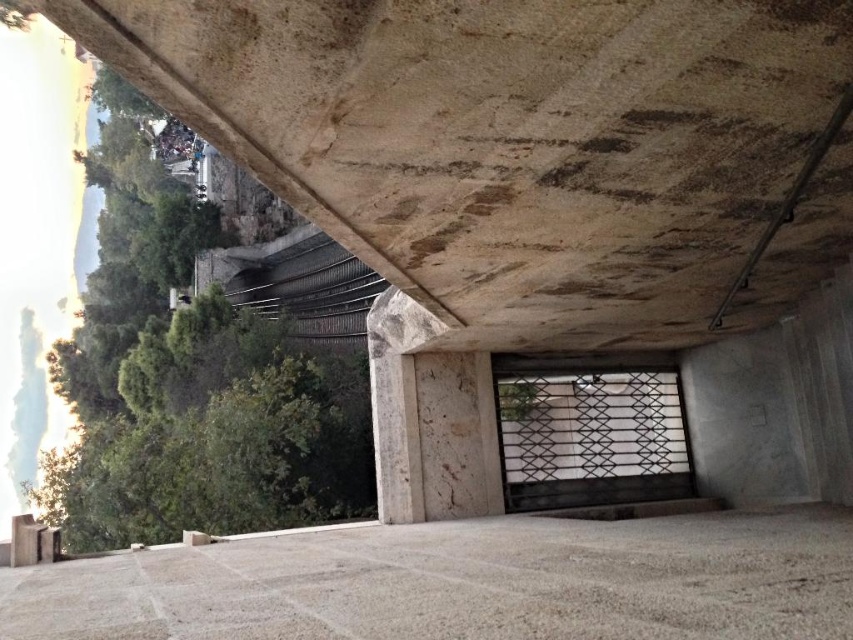
Question: Which point is farther from the camera taking this photo?

Choices:
 (A) (492, 64)
 (B) (682, 577)

Answer: (B)

Question: Does rustic stone overpass at upper center lie in front of gray stone floor at center?

Choices:
 (A) yes
 (B) no

Answer: (B)

Question: Which object appears farthest from the camera in this image?

Choices:
 (A) gray stone floor at center
 (B) rustic stone overpass at upper center

Answer: (B)

Question: Which of the following is the closest to the observer?

Choices:
 (A) gray stone floor at center
 (B) rustic stone overpass at upper center

Answer: (A)

Question: Does rustic stone overpass at upper center appear under gray stone floor at center?

Choices:
 (A) yes
 (B) no

Answer: (B)

Question: Is rustic stone overpass at upper center thinner than gray stone floor at center?

Choices:
 (A) yes
 (B) no

Answer: (A)